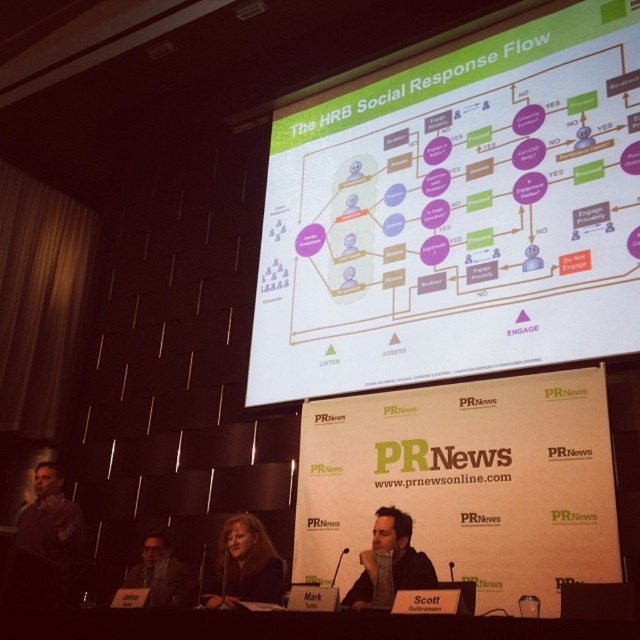
Does dark brown leather jacket at lower left appear on the right side of dark gray suit at lower left?

Incorrect, dark brown leather jacket at lower left is not on the right side of dark gray suit at lower left.

Between point (36, 518) and point (168, 568), which one is positioned behind?

Positioned behind is point (36, 518).

Locate an element on the screen. dark brown leather jacket at lower left is located at coordinates (51, 520).

What are the coordinates of `dark brown leather jacket at lower left` in the screenshot? It's located at (51, 520).

Does white paper at upper center have a lesser height compared to dark brown hair at center?

Incorrect, white paper at upper center's height does not fall short of dark brown hair at center's.

Which is more to the right, white paper at upper center or dark brown hair at center?

white paper at upper center

This screenshot has height=640, width=640. Find the location of `white paper at upper center`. white paper at upper center is located at coordinates (456, 214).

Between point (218, 605) and point (154, 561), which one is positioned behind?

The point (154, 561) is behind.

Between point (268, 547) and point (168, 545), which one is positioned in front?

Positioned in front is point (268, 547).

Identify the location of dark brown hair at center. (244, 564).